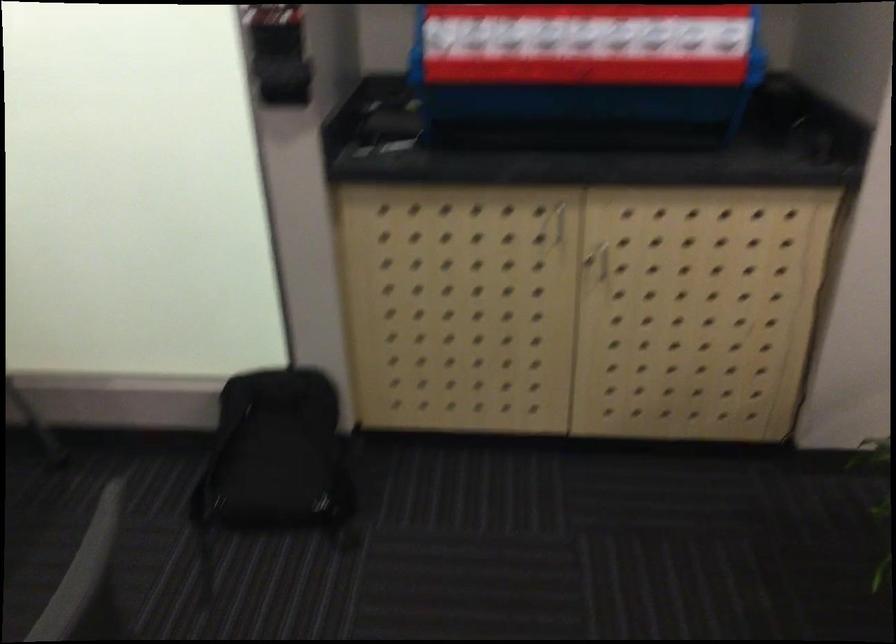
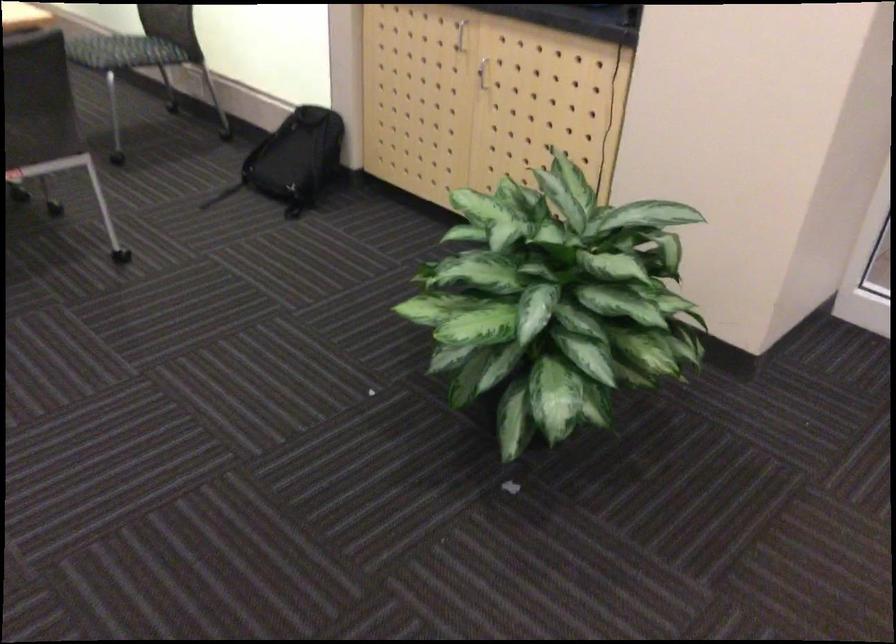
The point at (615, 259) is marked in the first image. Where is the corresponding point in the second image?

(483, 73)